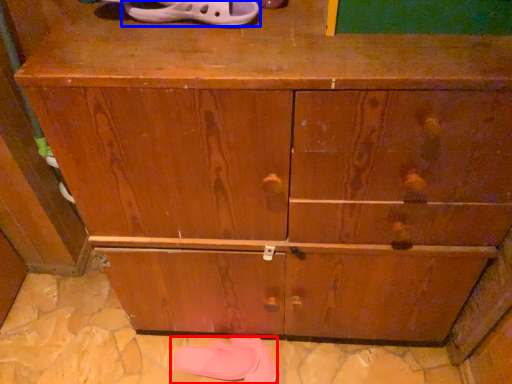
Question: Among these objects, which one is farthest to the camera, footwear (highlighted by a red box) or footwear (highlighted by a blue box)?

Choices:
 (A) footwear
 (B) footwear

Answer: (A)